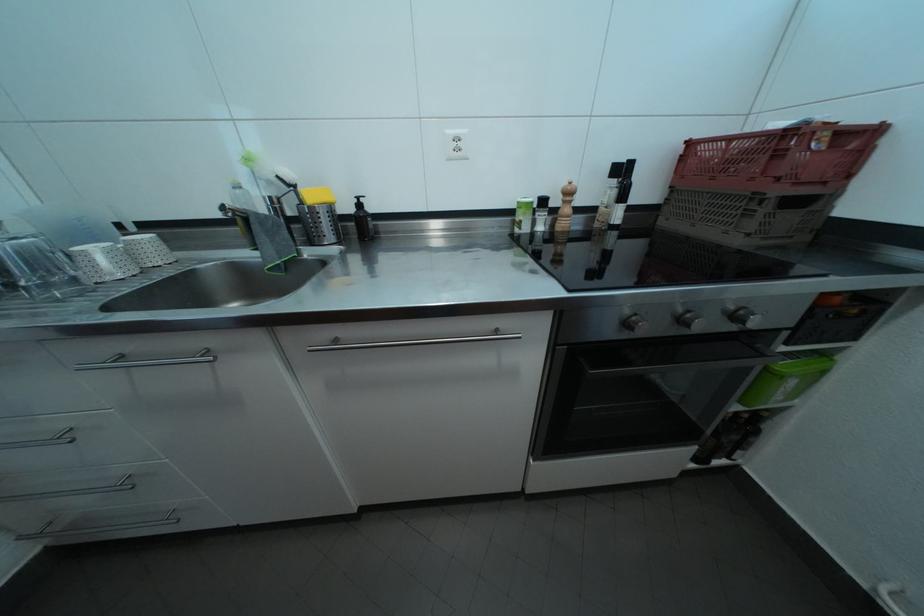
Image resolution: width=924 pixels, height=616 pixels. I want to click on faucet handle, so click(x=285, y=193).